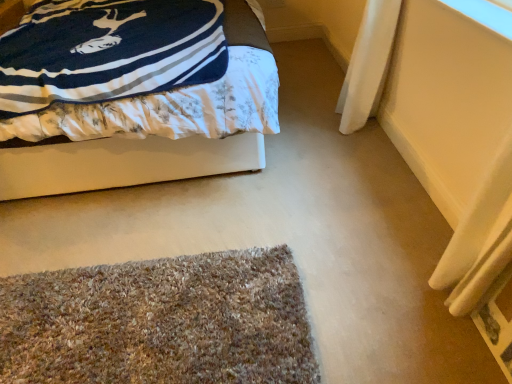
At what (x,y) coordinates should I click in order to perform the action: click on vacant area situated below multicolored shaggy mat at lower center (from a real-world perspective). Please return your answer as a coordinate pair (x, y). Image resolution: width=512 pixels, height=384 pixels. Looking at the image, I should click on (128, 322).